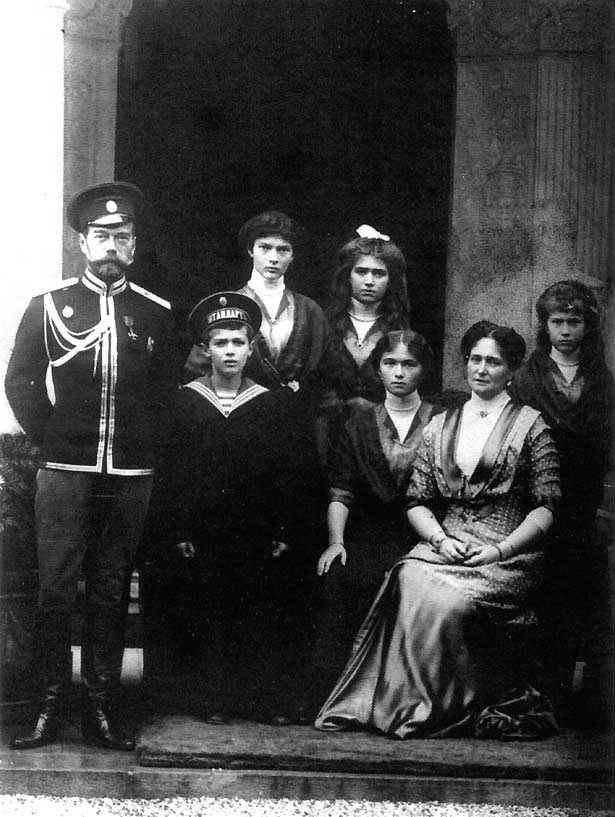
Image resolution: width=615 pixels, height=817 pixels. Find the location of `chair`. chair is located at coordinates (515, 613).